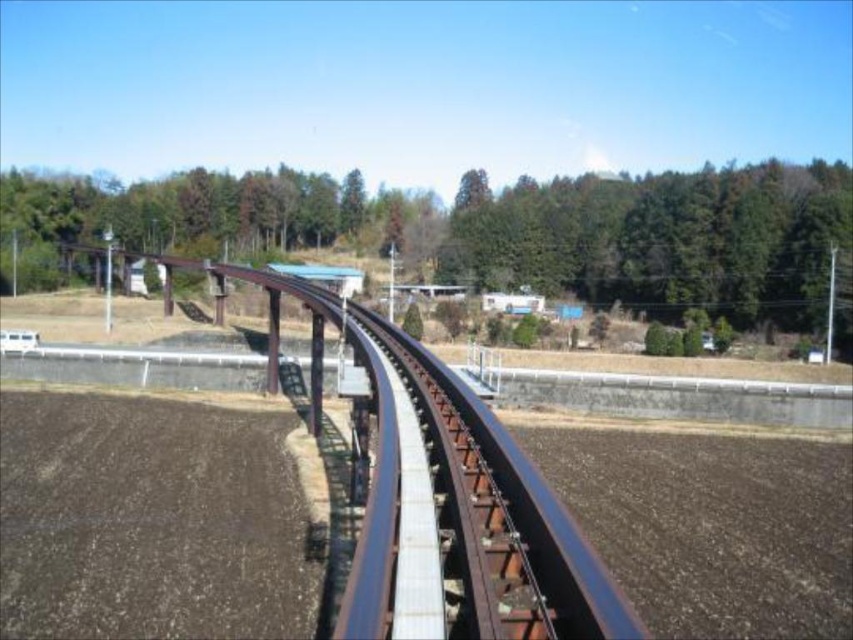
Question: Does brown soil at lower left appear on the left side of green leafy trees at upper center?

Choices:
 (A) no
 (B) yes

Answer: (B)

Question: Which object is the farthest from the brown soil at lower left?

Choices:
 (A) green leafy trees at upper center
 (B) green leafy tree at upper center

Answer: (B)

Question: Based on their relative distances, which object is farther from the green leafy trees at upper center?

Choices:
 (A) brown soil at lower left
 (B) green leafy tree at upper center

Answer: (A)

Question: Which object is farther from the camera taking this photo?

Choices:
 (A) brown soil at lower left
 (B) green leafy trees at upper center
 (C) green leafy tree at upper center

Answer: (C)

Question: Can you confirm if green leafy tree at upper center is thinner than green leafy trees at upper center?

Choices:
 (A) yes
 (B) no

Answer: (B)

Question: From the image, what is the correct spatial relationship of green leafy tree at upper center in relation to brown soil at lower left?

Choices:
 (A) left
 (B) right

Answer: (A)